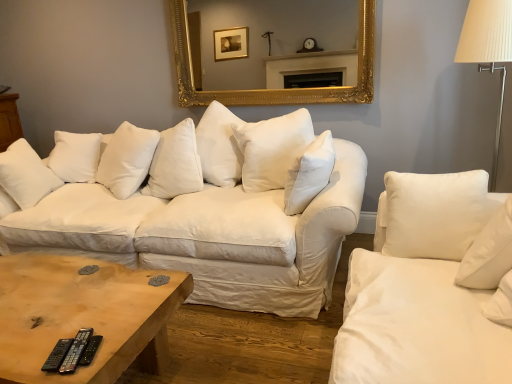
Locate an element on the screen. The height and width of the screenshot is (384, 512). vacant area on top of wooden coffee table at center (from a real-world perspective) is located at coordinates (52, 292).